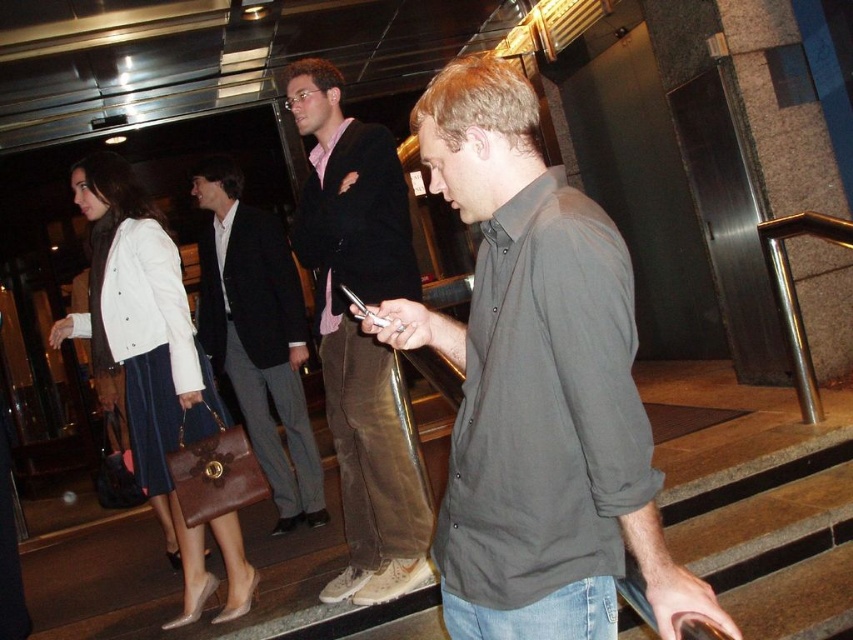
Which is below, velvet skirt at center or dark brown leather briefcase at center?

velvet skirt at center is lower down.

Does velvet skirt at center come behind dark brown leather briefcase at center?

That is False.

Who is more forward, [183,364] or [242,285]?

Point [183,364] is in front.

Locate an element on the screen. The height and width of the screenshot is (640, 853). velvet skirt at center is located at coordinates (144, 344).

Between gray matte shirt at center and brown suede pants at center, which one is positioned lower?

Positioned lower is gray matte shirt at center.

Is point (618, 490) behind point (355, 170)?

That is False.

Is point (573, 554) closer to viewer compared to point (339, 124)?

Yes, it is in front of point (339, 124).

I want to click on gray matte shirt at center, so click(537, 387).

Looking at this image, can you confirm if gray matte shirt at center is positioned to the right of velvet skirt at center?

Yes, gray matte shirt at center is to the right of velvet skirt at center.

Does gray matte shirt at center lie behind velvet skirt at center?

No.

Is point (585, 204) positioned after point (186, 401)?

No, (585, 204) is closer to viewer.

Where is `gray matte shirt at center`? gray matte shirt at center is located at coordinates (537, 387).